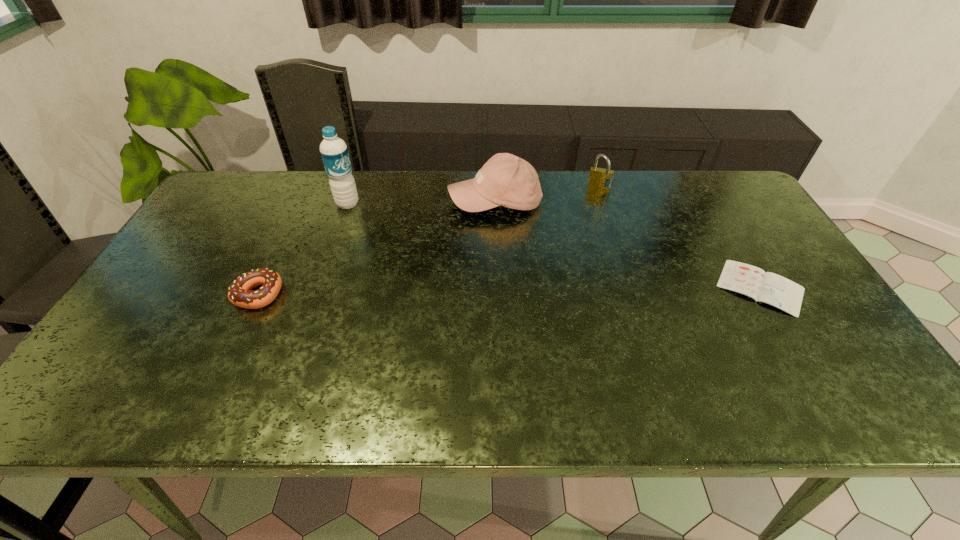
Image resolution: width=960 pixels, height=540 pixels. Identify the location of the fourth closest object to the third tallest object. (240, 294).

The width and height of the screenshot is (960, 540). Find the location of `the second closest object to the fourth object from right to left`. the second closest object to the fourth object from right to left is located at coordinates (240, 294).

Find the location of a particular element. The image size is (960, 540). vacant region that satisfies the following two spatial constraints: 1. on the front side of the water bottle; 2. on the left side of the shortest object is located at coordinates [x=319, y=287].

Identify the location of vacant area that satisfies the following two spatial constraints: 1. on the back side of the padlock; 2. on the right side of the tallest object. Image resolution: width=960 pixels, height=540 pixels. (353, 189).

Locate an element on the screen. This screenshot has width=960, height=540. vacant area that satisfies the following two spatial constraints: 1. on the back side of the water bottle; 2. on the right side of the leftmost object is located at coordinates (300, 204).

You are a GUI agent. You are given a task and a screenshot of the screen. Output one action in this format:
    pyautogui.click(x=<x>, y=<y>)
    Task: Click on the vacant space that satisfies the following two spatial constraints: 1. on the back side of the tallest object; 2. on the left side of the third object from left to right
    This screenshot has width=960, height=540.
    Given the screenshot: What is the action you would take?
    pyautogui.click(x=348, y=201)

I want to click on free space that satisfies the following two spatial constraints: 1. on the back side of the tallest object; 2. on the left side of the second object from right to left, so click(353, 189).